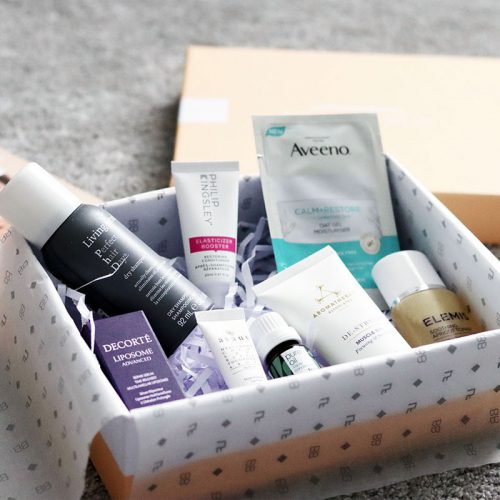
Identify the location of liquid foundation glass bottle in bottom right corner of gift box. This screenshot has width=500, height=500. 438,319, 416,280.